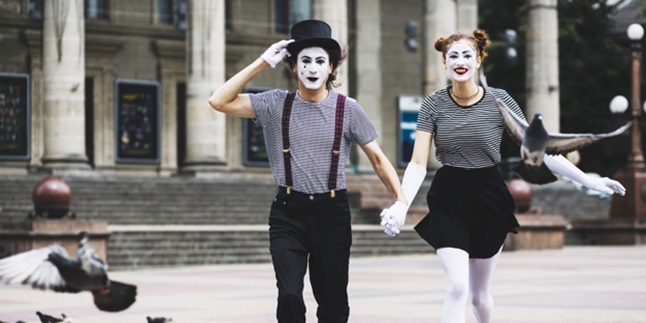
Find the location of a particular element. stairs is located at coordinates (194, 226).